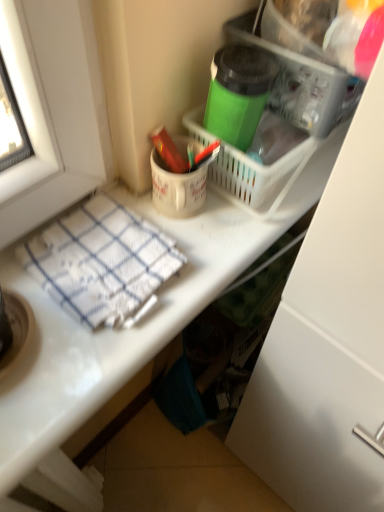
Find the location of a particular element. The image size is (384, 512). green matte thermos at upper center is located at coordinates (238, 92).

Locate an element on the screen. white woven towel at lower left is located at coordinates (101, 261).

Image resolution: width=384 pixels, height=512 pixels. I want to click on green matte thermos at upper center, so click(x=238, y=92).

Which of these two, matte red crayon at upper center or white woven towel at lower left, is wider?

With larger width is white woven towel at lower left.

Would you say white woven towel at lower left is part of matte red crayon at upper center's contents?

No, matte red crayon at upper center does not contain white woven towel at lower left.

Looking at this image, from a real-world perspective, between matte red crayon at upper center and white woven towel at lower left, who is vertically higher?

matte red crayon at upper center.

Does point (99, 233) appear closer or farther from the camera than point (216, 74)?

Point (99, 233) appears to be farther away from the viewer than point (216, 74).

Can you confirm if white woven towel at lower left is shorter than green matte thermos at upper center?

Indeed, white woven towel at lower left has a lesser height compared to green matte thermos at upper center.

Is white woven towel at lower left to the left or to the right of green matte thermos at upper center in the image?

In the image, white woven towel at lower left appears on the left side of green matte thermos at upper center.

Is white woven towel at lower left inside the boundaries of green matte thermos at upper center, or outside?

white woven towel at lower left is located beyond the bounds of green matte thermos at upper center.

In terms of width, does white woven towel at lower left look wider or thinner when compared to matte red crayon at upper center?

Considering their sizes, white woven towel at lower left looks broader than matte red crayon at upper center.

Can you confirm if white woven towel at lower left is shorter than matte red crayon at upper center?

Yes.

From the image's perspective, which is below, white woven towel at lower left or matte red crayon at upper center?

white woven towel at lower left.

From a real-world perspective, is white woven towel at lower left physically located above or below matte red crayon at upper center?

white woven towel at lower left is situated lower than matte red crayon at upper center in the real world.

In the scene shown: How far apart are green matte thermos at upper center and white woven towel at lower left?

green matte thermos at upper center is 8.68 inches away from white woven towel at lower left.

In terms of width, does green matte thermos at upper center look wider or thinner when compared to white woven towel at lower left?

Considering their sizes, green matte thermos at upper center looks slimmer than white woven towel at lower left.

How many degrees apart are the facing directions of green matte thermos at upper center and white woven towel at lower left?

They differ by 2.33 degrees in their facing directions.

Is green matte thermos at upper center touching white woven towel at lower left?

No, green matte thermos at upper center is not in contact with white woven towel at lower left.

Is green matte thermos at upper center facing towards matte red crayon at upper center?

No, green matte thermos at upper center does not turn towards matte red crayon at upper center.

From the image's perspective, which is below, green matte thermos at upper center or matte red crayon at upper center?

matte red crayon at upper center is shown below in the image.

Considering the relative sizes of green matte thermos at upper center and matte red crayon at upper center in the image provided, is green matte thermos at upper center shorter than matte red crayon at upper center?

No.

Find the location of `bottle on the right of matte red crayon at upper center`. bottle on the right of matte red crayon at upper center is located at coordinates (238, 92).

Find the location of `bottle that is above the matte red crayon at upper center (from the image's perspective)`. bottle that is above the matte red crayon at upper center (from the image's perspective) is located at coordinates (238, 92).

Is point (160, 128) positioned before point (257, 110)?

No, it is not.

Would you say matte red crayon at upper center contains green matte thermos at upper center?

No, green matte thermos at upper center is not surrounded by matte red crayon at upper center.

What's the angular difference between matte red crayon at upper center and green matte thermos at upper center's facing directions?

The angular difference between matte red crayon at upper center and green matte thermos at upper center is 2.33 degrees.

Locate an element on the screen. blanket on the left of matte red crayon at upper center is located at coordinates (101, 261).

This screenshot has height=512, width=384. In order to click on bottle above the white woven towel at lower left (from the image's perspective) in this screenshot , I will do `click(238, 92)`.

Based on their spatial positions, is green matte thermos at upper center or white woven towel at lower left closer to matte red crayon at upper center?

green matte thermos at upper center lies closer to matte red crayon at upper center than the other object.

From the image, which object appears to be farther from green matte thermos at upper center, matte red crayon at upper center or white woven towel at lower left?

white woven towel at lower left is positioned further to the anchor green matte thermos at upper center.

Looking at the image, which one is located further to green matte thermos at upper center, white woven towel at lower left or matte red crayon at upper center?

Among the two, white woven towel at lower left is located further to green matte thermos at upper center.

Considering their positions, is green matte thermos at upper center positioned further to white woven towel at lower left than matte red crayon at upper center?

The object further to white woven towel at lower left is green matte thermos at upper center.

Looking at the image, which one is located closer to white woven towel at lower left, matte red crayon at upper center or green matte thermos at upper center?

Among the two, matte red crayon at upper center is located nearer to white woven towel at lower left.

From the image, which object appears to be nearer to matte red crayon at upper center, white woven towel at lower left or green matte thermos at upper center?

Result: Based on the image, green matte thermos at upper center appears to be nearer to matte red crayon at upper center.

What are the coordinates of `crayon that lies between green matte thermos at upper center and white woven towel at lower left from top to bottom` in the screenshot? It's located at coord(168,150).